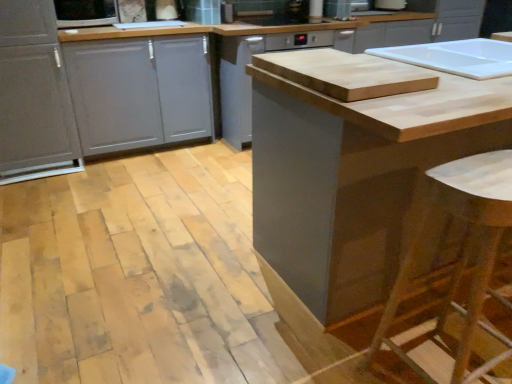
Question: From a real-world perspective, is wooden bar stool at lower right positioned above or below matte white microwave at upper left?

Choices:
 (A) above
 (B) below

Answer: (B)

Question: Would you say wooden bar stool at lower right is to the left or to the right of matte white microwave at upper left in the picture?

Choices:
 (A) right
 (B) left

Answer: (A)

Question: Estimate the real-world distances between objects in this image. Which object is closer to the matte gray drawer at left?

Choices:
 (A) matte gray cabinet at left, arranged as the third cabinetry when viewed from the right
 (B) matte gray cabinet at center, the third cabinetry viewed from the left
 (C) natural wood cutting board at center
 (D) matte white microwave at upper left
 (E) metallic silver dishwasher at upper center

Answer: (A)

Question: Which object is positioned closest to the wooden bar stool at lower right?

Choices:
 (A) matte white microwave at upper left
 (B) matte gray dishwasher at center, the 2th cabinetry when ordered from left to right
 (C) metallic silver dishwasher at upper center
 (D) matte gray cabinet at center, which ranks as the 1th cabinetry in right-to-left order
 (E) natural wood cutting board at center

Answer: (D)